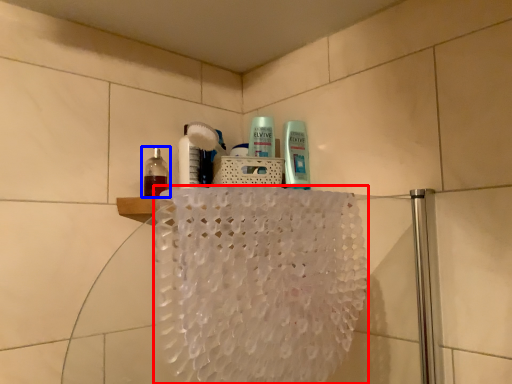
Question: Which of the following is the farthest to the observer, bath towel (highlighted by a red box) or bottle (highlighted by a blue box)?

Choices:
 (A) bath towel
 (B) bottle

Answer: (B)